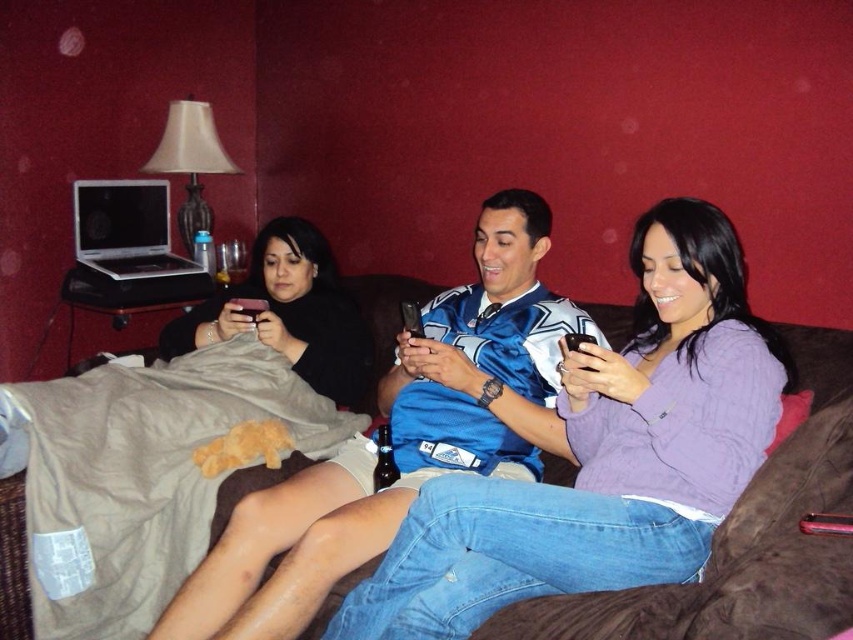
Question: Can you confirm if black matte phone at upper left is positioned to the left of black glass beer bottle at center?

Choices:
 (A) no
 (B) yes

Answer: (B)

Question: Which point is farther from the camera taking this photo?

Choices:
 (A) (251, 586)
 (B) (32, 522)

Answer: (B)

Question: Estimate the real-world distances between objects in this image. Which object is farther from the black glass beer bottle at center?

Choices:
 (A) black matte phone at upper left
 (B) purple sweater at center
 (C) blue satin jersey at center

Answer: (B)

Question: Which of the following is the farthest from the observer?

Choices:
 (A) (544, 576)
 (B) (245, 356)
 (C) (537, 243)

Answer: (B)

Question: Is purple sweater at center closer to the viewer compared to black matte phone at upper left?

Choices:
 (A) yes
 (B) no

Answer: (A)

Question: Is purple sweater at center to the right of black glass beer bottle at center from the viewer's perspective?

Choices:
 (A) no
 (B) yes

Answer: (B)